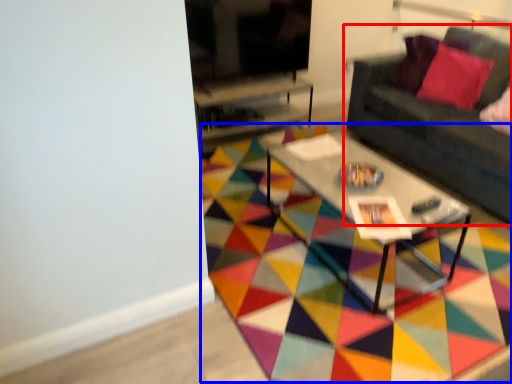
Question: Which of the following is the farthest to the observer, studio couch (highlighted by a red box) or mat (highlighted by a blue box)?

Choices:
 (A) studio couch
 (B) mat

Answer: (A)